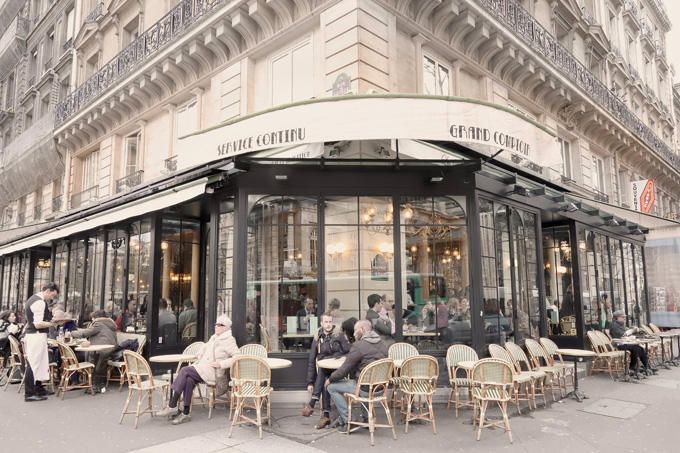
At what (x,y) coordinates should I click in order to perform the action: click on tables. Please return your answer as a coordinate pair (x, y). The width and height of the screenshot is (680, 453). Looking at the image, I should click on [581, 351], [639, 336], [668, 329], [673, 329], [330, 367], [283, 361], [173, 357], [86, 347], [52, 341].